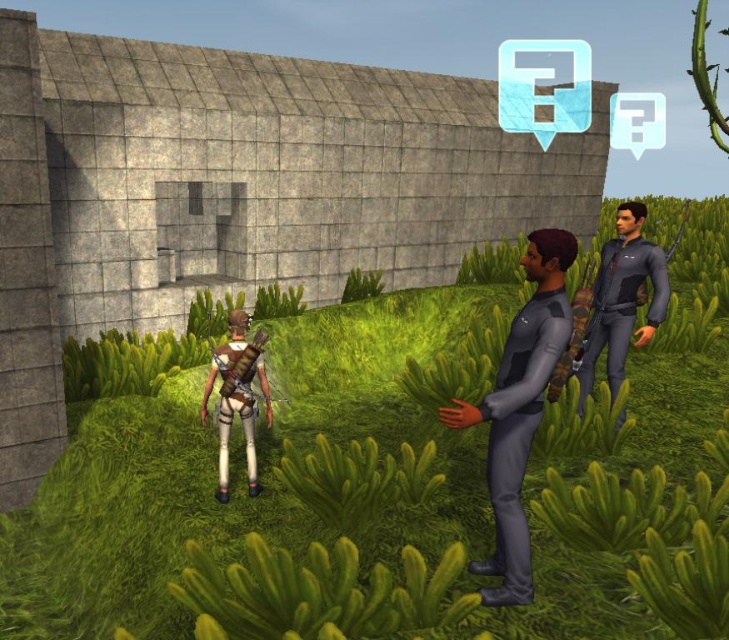
Is green grass at center further to the viewer compared to white matte pants at center?

No, green grass at center is in front of white matte pants at center.

Is point (713, 604) positioned before point (211, 385)?

Yes.

Which is behind, point (416, 314) or point (252, 404)?

Point (416, 314)

Locate an element on the screen. The width and height of the screenshot is (729, 640). green grass at center is located at coordinates (370, 484).

Which of these two, dark gray matte uniform at center or dark gray fabric shirt at right, stands shorter?

dark gray fabric shirt at right is shorter.

Based on the photo, who is higher up, dark gray matte uniform at center or dark gray fabric shirt at right?

dark gray fabric shirt at right

I want to click on dark gray matte uniform at center, so click(518, 410).

Between green grass at center and dark gray fabric shirt at right, which one appears on the left side from the viewer's perspective?

Positioned to the left is dark gray fabric shirt at right.

Is point (655, 525) positioned behind point (627, 209)?

No.

Image resolution: width=729 pixels, height=640 pixels. Find the location of `green grass at center`. green grass at center is located at coordinates (x=370, y=484).